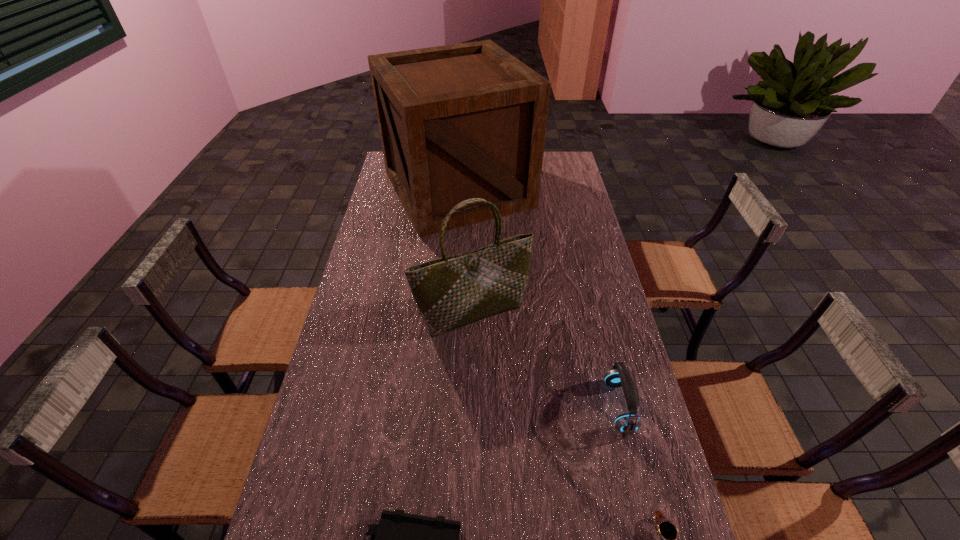
The image size is (960, 540). I want to click on free space located on the ear cups of the headset, so click(x=468, y=407).

You are a GUI agent. You are given a task and a screenshot of the screen. Output one action in this format:
    pyautogui.click(x=<x>, y=<y>)
    Task: Click on the object present at the far edge
    
    Given the screenshot: What is the action you would take?
    pyautogui.click(x=462, y=121)

The width and height of the screenshot is (960, 540). Find the location of `object that is at the left edge`. object that is at the left edge is located at coordinates (462, 121).

Where is `object present at the right edge`? object present at the right edge is located at coordinates (618, 376).

The width and height of the screenshot is (960, 540). What are the coordinates of `object that is at the far left corner` in the screenshot? It's located at click(462, 121).

In order to click on vacant region at the left edge in this screenshot , I will do `click(370, 315)`.

You are a GUI agent. You are given a task and a screenshot of the screen. Output one action in this format:
    pyautogui.click(x=<x>, y=<y>)
    Task: Click on the vacant space at the right edge
    This screenshot has height=540, width=960.
    Given the screenshot: What is the action you would take?
    pyautogui.click(x=612, y=332)

Image resolution: width=960 pixels, height=540 pixels. I want to click on empty space between the shopping bag and the headset, so click(546, 360).

Locate an element on the screen. The width and height of the screenshot is (960, 540). empty location between the fourth shortest object and the headset is located at coordinates tap(546, 360).

Find the location of a particular element. The width and height of the screenshot is (960, 540). vacant area that lies between the shopping bag and the tallest object is located at coordinates click(466, 251).